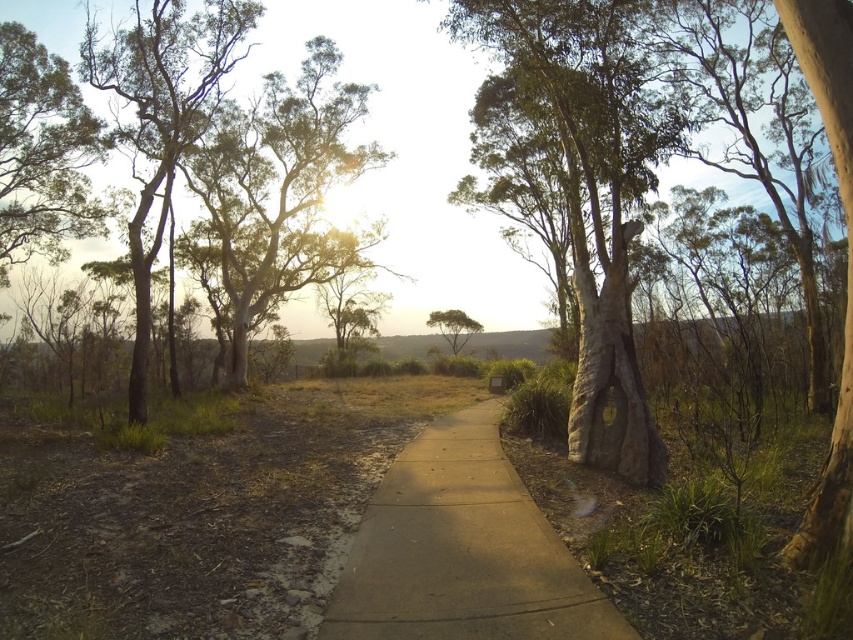
Which is in front, point (601, 298) or point (848, 372)?

Point (848, 372) is more forward.

Which is above, smooth bark tree at center or brown rough bark tree at right?

smooth bark tree at center

This screenshot has height=640, width=853. In order to click on smooth bark tree at center in this screenshot , I will do `click(590, 195)`.

Locate an element on the screen. The width and height of the screenshot is (853, 640). smooth bark tree at center is located at coordinates (590, 195).

Is concrete at center wider than green leafy tree at upper left?

No.

You are a GUI agent. You are given a task and a screenshot of the screen. Output one action in this format:
    pyautogui.click(x=<x>, y=<y>)
    Task: Click on the concrete at center
    The width and height of the screenshot is (853, 640).
    Given the screenshot: What is the action you would take?
    pyautogui.click(x=462, y=550)

Is point (573, 579) more distant than point (48, 145)?

No, it is in front of (48, 145).

At what (x,y) coordinates should I click in order to perform the action: click on concrete at center. Please return your answer as a coordinate pair (x, y). Looking at the image, I should click on (462, 550).

Is green rough bark tree at upper left wider than brown rough bark tree at right?

Indeed, green rough bark tree at upper left has a greater width compared to brown rough bark tree at right.

Does green rough bark tree at upper left have a smaller size compared to brown rough bark tree at right?

No, green rough bark tree at upper left is not smaller than brown rough bark tree at right.

Find the location of a particular element. This screenshot has height=640, width=853. green rough bark tree at upper left is located at coordinates (281, 189).